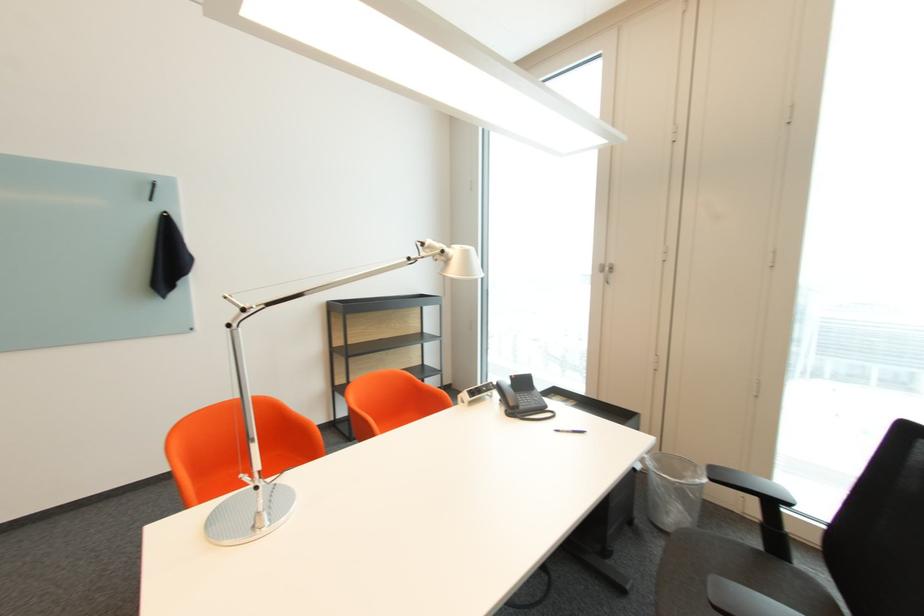
The image size is (924, 616). In order to click on black wall hook in this screenshot , I will do `click(152, 190)`.